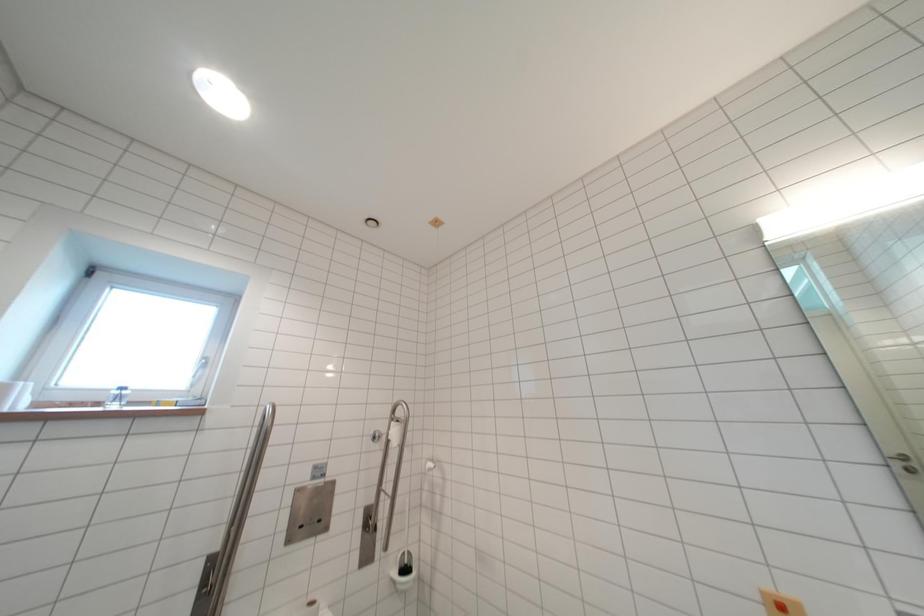
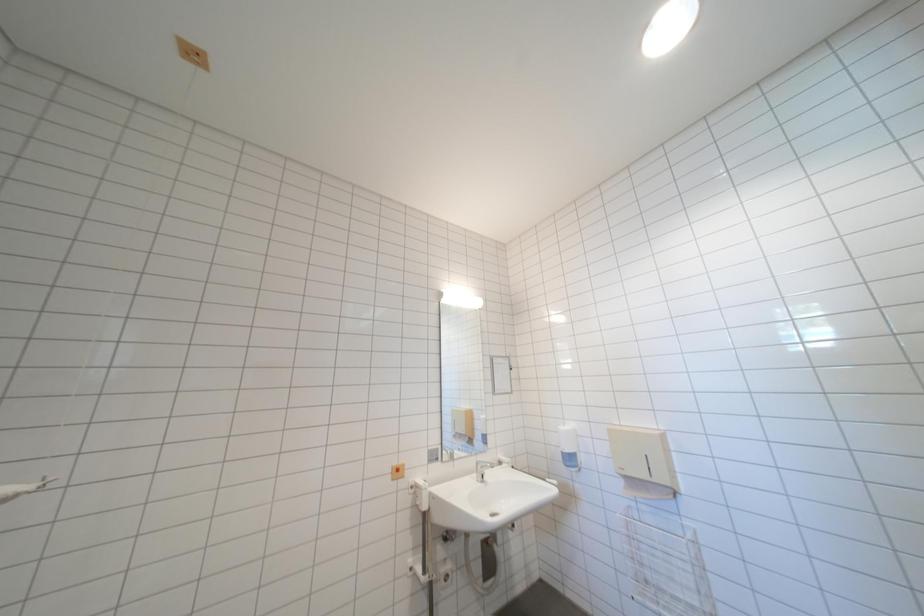
Question: The camera is either moving clockwise (left) or counter-clockwise (right) around the object. The first image is from the beginning of the video and the second image is from the end. Is the camera moving left or right when shooting the video?

Choices:
 (A) Left
 (B) Right

Answer: (A)